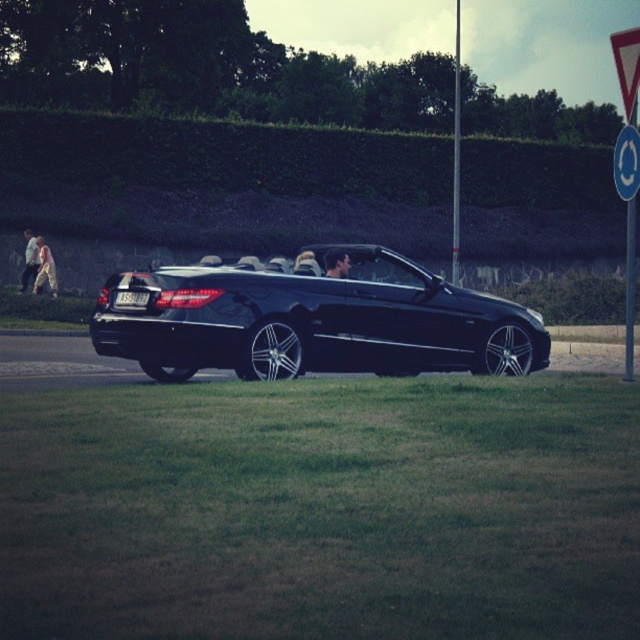
Question: Which object appears farthest from the camera in this image?

Choices:
 (A) blue circular sign at upper right
 (B) smooth leather jacket at center
 (C) light beige fabric dress at left

Answer: (C)

Question: Which point appears closest to the camera in this image?

Choices:
 (A) pos(221,355)
 (B) pos(22,280)
 (C) pos(45,257)

Answer: (A)

Question: From the image, what is the correct spatial relationship of light beige fabric pants at left in relation to black plastic license plate at center?

Choices:
 (A) left
 (B) right

Answer: (A)

Question: From the image, what is the correct spatial relationship of smooth leather jacket at center in relation to black plastic license plate at center?

Choices:
 (A) left
 (B) right

Answer: (B)

Question: Which is farther from the blue circular sign at upper right?

Choices:
 (A) black metallic convertible at center
 (B) light beige fabric dress at left
 (C) black plastic license plate at center

Answer: (B)

Question: Can you confirm if black metallic convertible at center is bigger than smooth leather jacket at center?

Choices:
 (A) no
 (B) yes

Answer: (B)